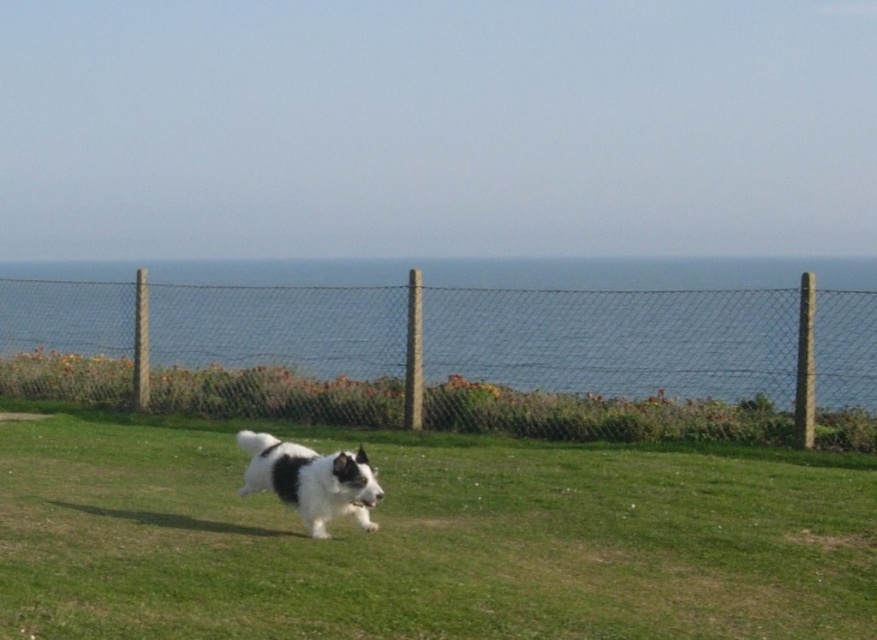
Question: Can you confirm if green grass at center is positioned above wire mesh fence at center?

Choices:
 (A) yes
 (B) no

Answer: (B)

Question: Which of the following is the closest to the observer?

Choices:
 (A) green grass at center
 (B) wire mesh fence at center
 (C) black-and-white fur dog at center

Answer: (A)

Question: Can you confirm if wire mesh fence at center is positioned above black-and-white fur dog at center?

Choices:
 (A) no
 (B) yes

Answer: (B)

Question: Estimate the real-world distances between objects in this image. Which object is closer to the green grass at center?

Choices:
 (A) black-and-white fur dog at center
 (B) wire mesh fence at center

Answer: (A)

Question: Which of the following is the farthest from the observer?

Choices:
 (A) wire mesh fence at center
 (B) green grass at center
 (C) black-and-white fur dog at center

Answer: (A)

Question: Does green grass at center have a greater width compared to black-and-white fur dog at center?

Choices:
 (A) no
 (B) yes

Answer: (B)